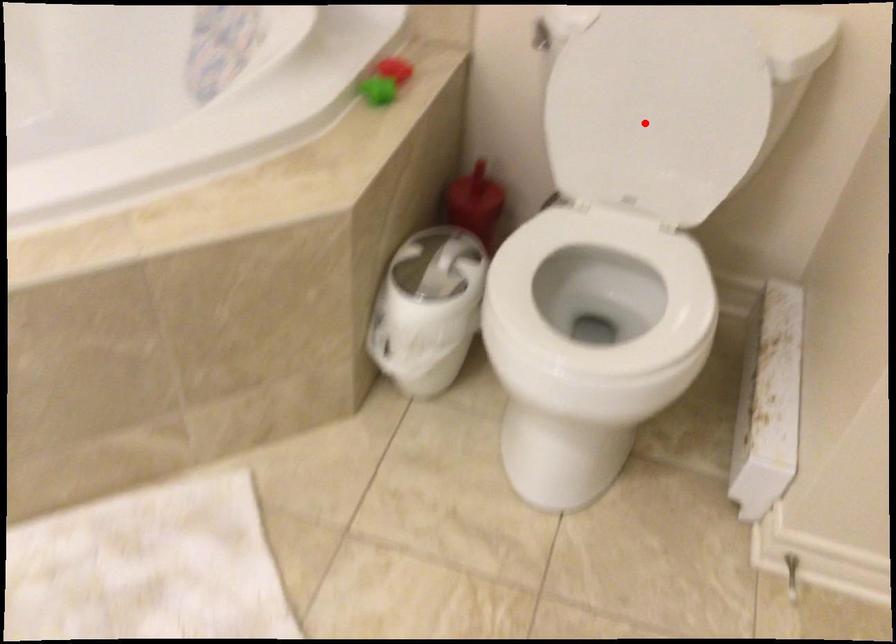
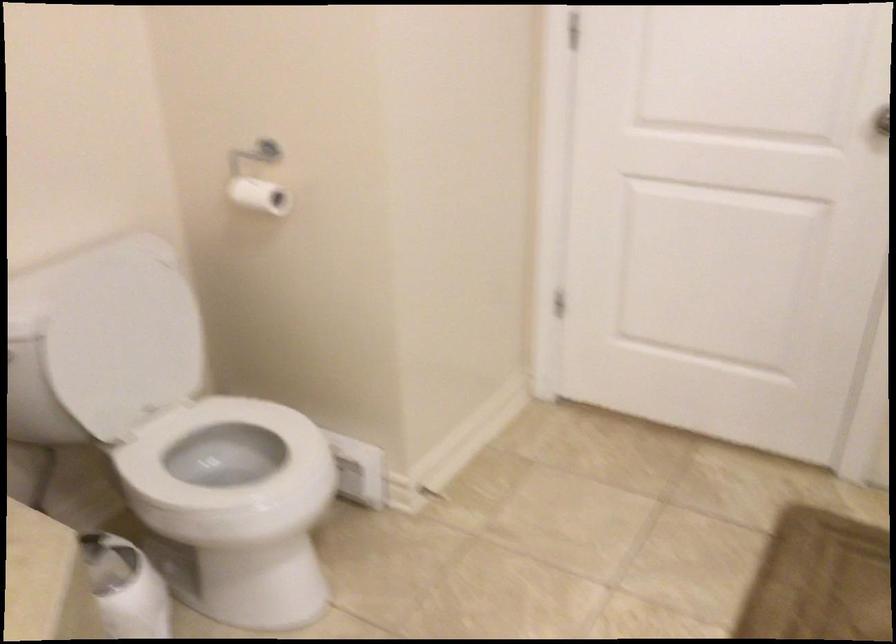
In the second image, find the point that corresponds to the highlighted location in the first image.

(122, 346)